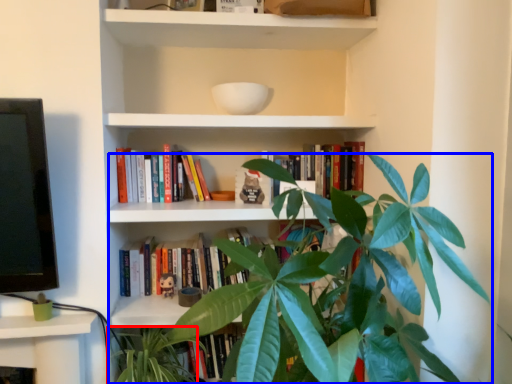
Question: Which of the following is the farthest to the observer, vegetation (highlighted by a red box) or houseplant (highlighted by a blue box)?

Choices:
 (A) vegetation
 (B) houseplant

Answer: (A)